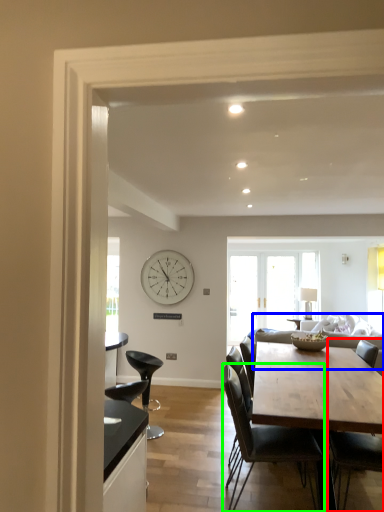
Question: Based on their relative distances, which object is nearer to chair (highlighted by a red box)? Choose from couch (highlighted by a blue box) and chair (highlighted by a green box).

Choices:
 (A) couch
 (B) chair

Answer: (B)